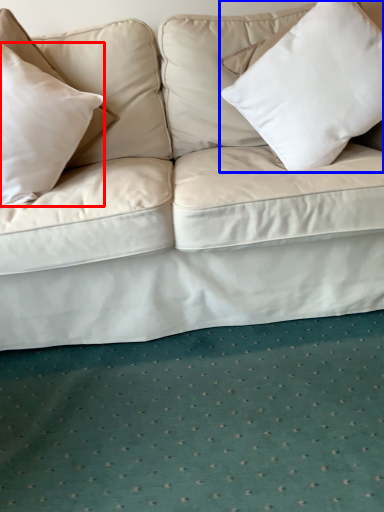
Question: Which point is further to the camera, pillow (highlighted by a red box) or pillow (highlighted by a blue box)?

Choices:
 (A) pillow
 (B) pillow

Answer: (B)